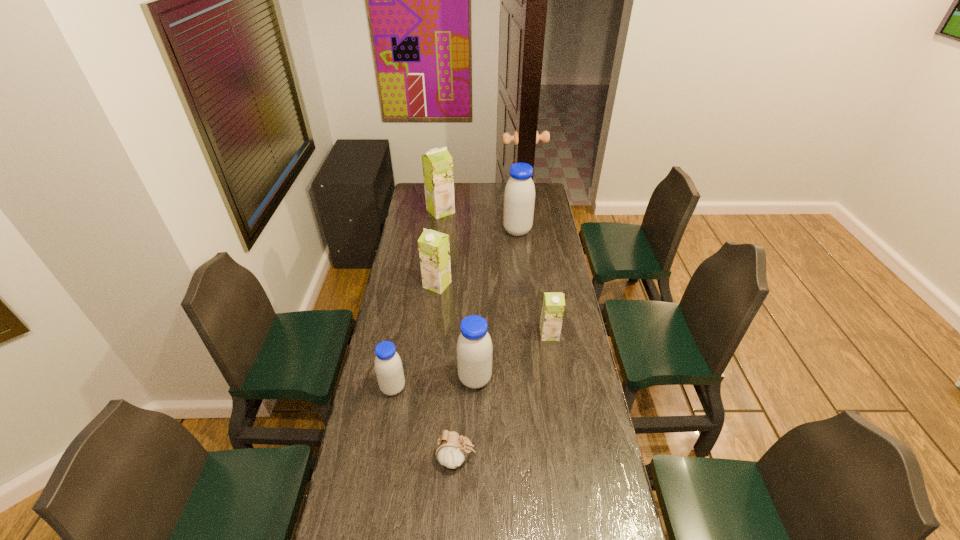
Where is `blank region between the biggest green soya milk and the leftmost blue soya milk`? Image resolution: width=960 pixels, height=540 pixels. blank region between the biggest green soya milk and the leftmost blue soya milk is located at coordinates (417, 300).

Locate an element on the screen. object that is the fifth closest one to the farthest green soya milk is located at coordinates (388, 366).

Select which object appears as the fourth closest to the fourth farthest object. Please provide its 2D coordinates. Your answer should be formatted as a tuple, i.e. [(x, y)], where the tuple contains the x and y coordinates of a point satisfying the conditions above.

[(388, 366)]

I want to click on soya milk object that ranks as the fifth closest to the rightmost green soya milk, so click(x=437, y=163).

Locate an element on the screen. The width and height of the screenshot is (960, 540). soya milk identified as the fourth closest to the fourth soya milk from left to right is located at coordinates (519, 196).

Locate an element on the screen. Image resolution: width=960 pixels, height=540 pixels. green soya milk that is the second closest to the smallest green soya milk is located at coordinates (437, 163).

Identify the location of green soya milk that is the third closest to the second farthest soya milk. This screenshot has width=960, height=540. (553, 306).

Identify which blue soya milk is the second nearest to the farthest blue soya milk. Please provide its 2D coordinates. Your answer should be formatted as a tuple, i.e. [(x, y)], where the tuple contains the x and y coordinates of a point satisfying the conditions above.

[(388, 366)]

What are the coordinates of `blue soya milk that stands as the closest to the second blue soya milk from right to left` in the screenshot? It's located at (388, 366).

Locate an element on the screen. The image size is (960, 540). blank space that satisfies the following two spatial constraints: 1. on the front side of the fourth nearest soya milk; 2. on the left side of the third nearest soya milk is located at coordinates (432, 334).